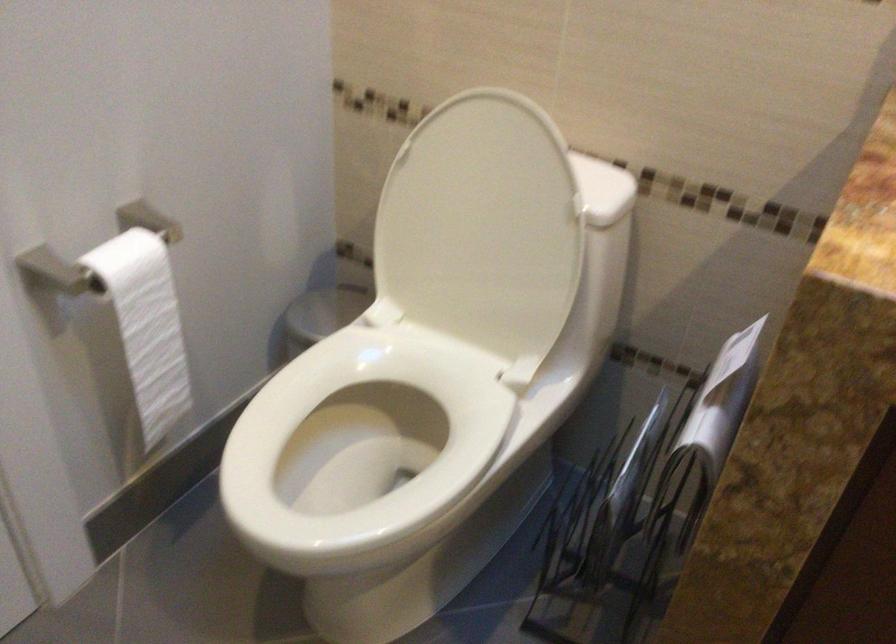
The height and width of the screenshot is (644, 896). Find the location of `white paper booklet`. white paper booklet is located at coordinates (730, 362).